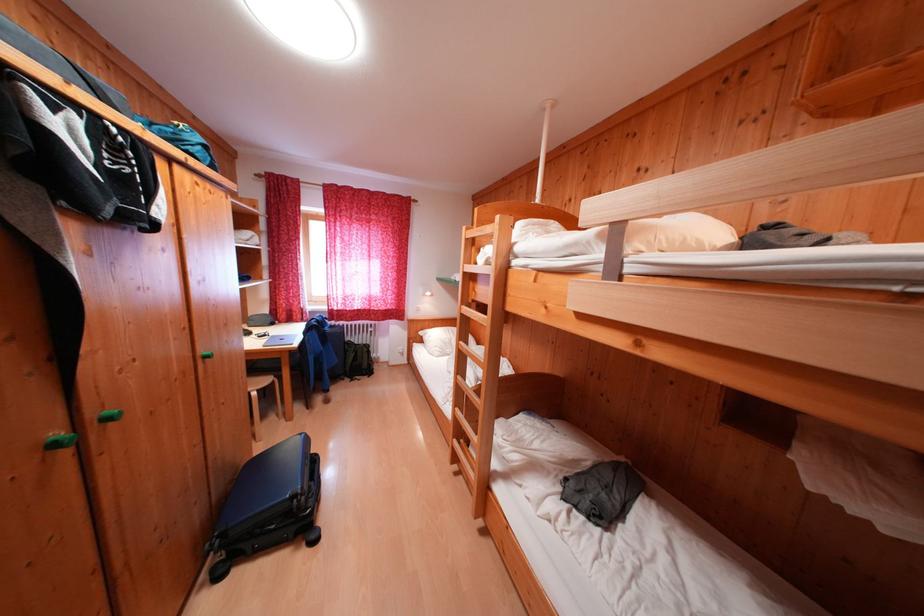
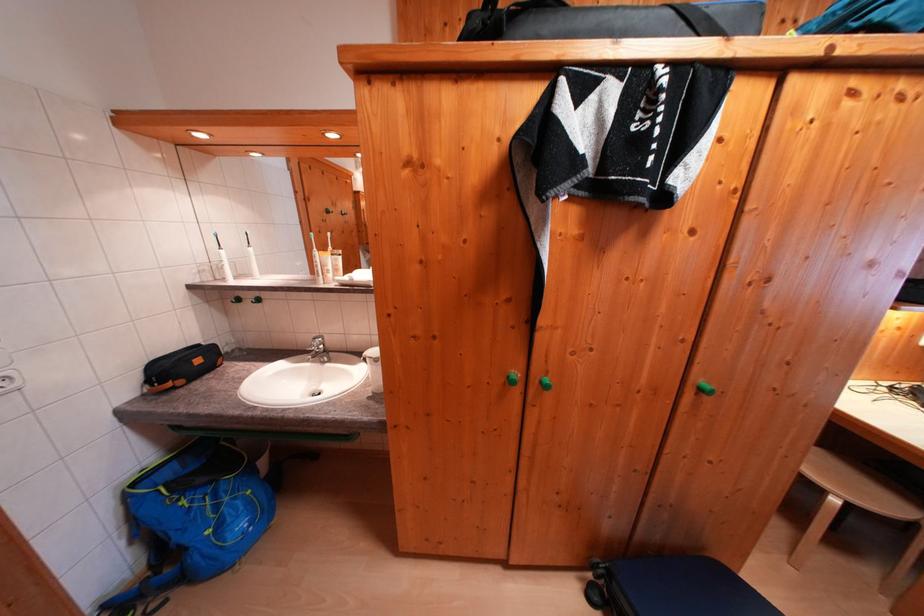
In the second image, find the point that corresponds to point (227, 582) in the first image.

(598, 602)